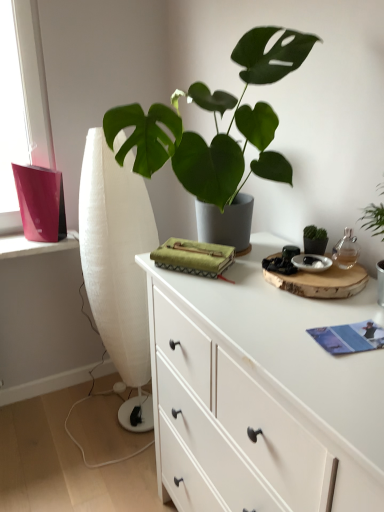
Where is `vacant space positioned to the left of white fabric curtain at left`? Image resolution: width=384 pixels, height=512 pixels. vacant space positioned to the left of white fabric curtain at left is located at coordinates (72, 418).